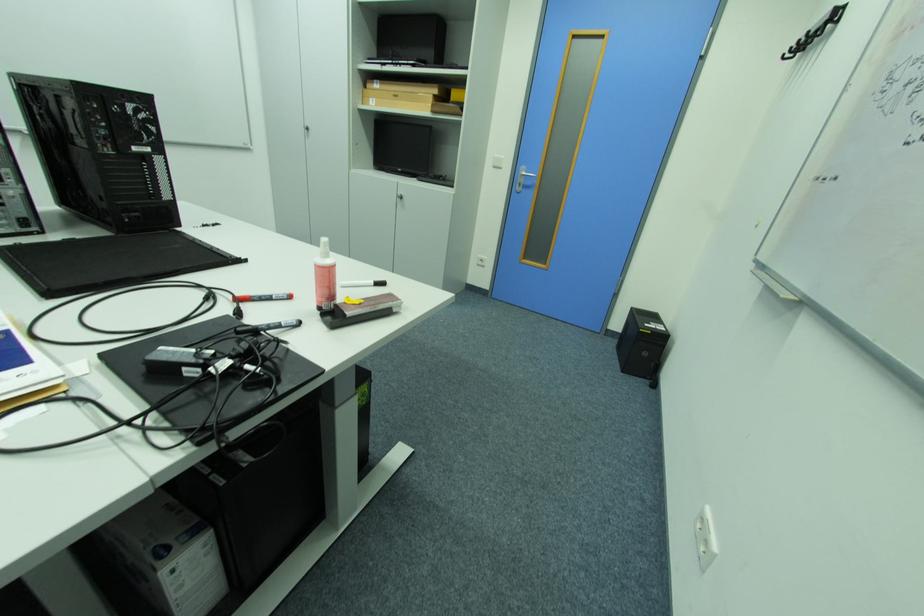
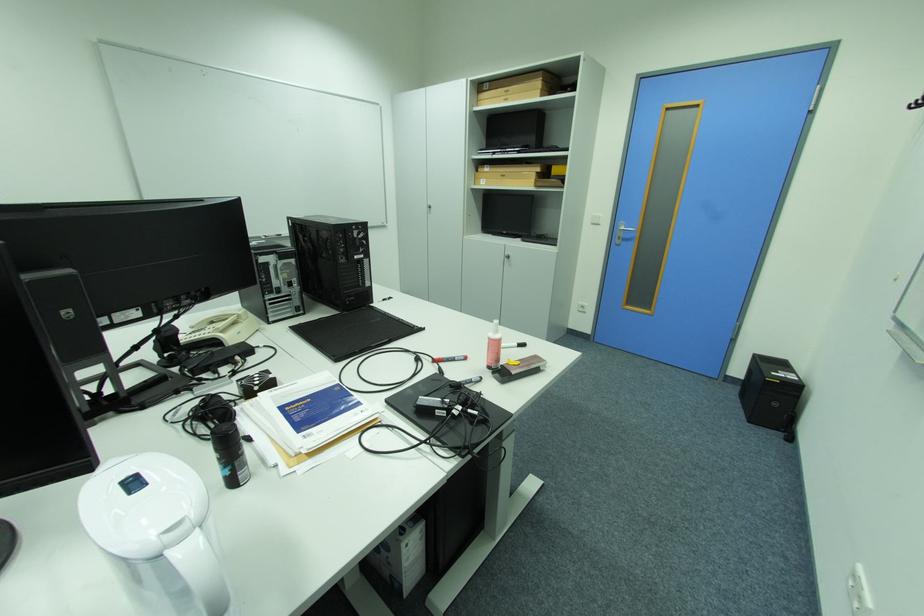
Find the pixel in the second image that matches (x=408, y=199) in the first image.

(516, 257)